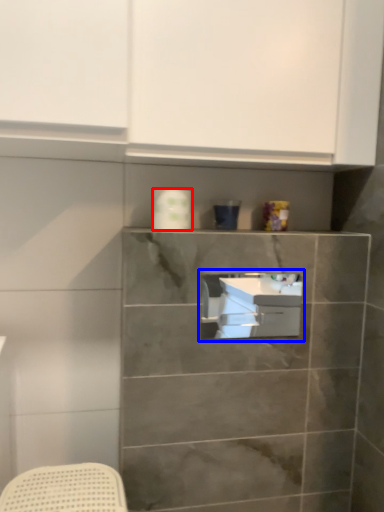
Question: Which of the following is the closest to the observer, toilet paper (highlighted by a red box) or sink (highlighted by a blue box)?

Choices:
 (A) toilet paper
 (B) sink

Answer: (B)